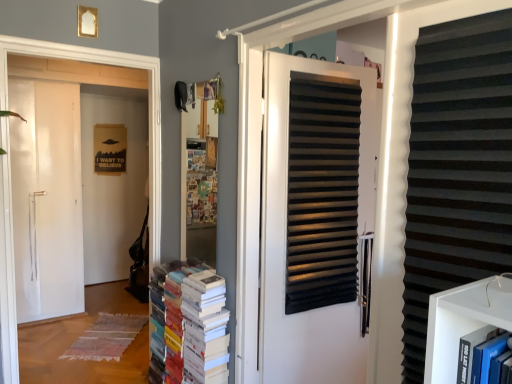
Question: In terms of height, does white matte door at left look taller or shorter compared to white matte door at center?

Choices:
 (A) tall
 (B) short

Answer: (A)

Question: Is white matte door at left in front of or behind white matte door at center in the image?

Choices:
 (A) front
 (B) behind

Answer: (B)

Question: Estimate the real-world distances between objects in this image. Which object is farther from the white matte door at center?

Choices:
 (A) multicolored paper books at center
 (B) black corrugated plastic at right
 (C) white matte door at left

Answer: (C)

Question: Which is nearer to the white matte door at left?

Choices:
 (A) black corrugated plastic at right
 (B) white matte door at center
 (C) multicolored paper books at center

Answer: (C)